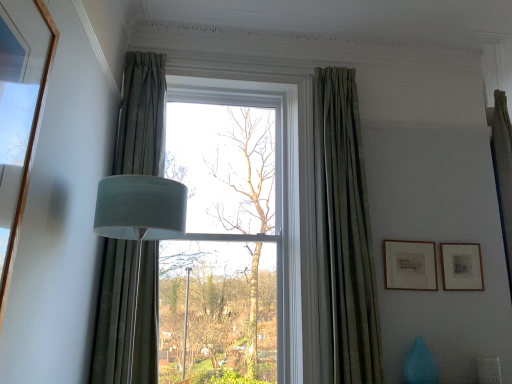
What is the approximate height of green fabric curtain at left, positioned as the 2th curtain in right-to-left order?

2.05 meters.

This screenshot has width=512, height=384. What do you see at coordinates (142, 116) in the screenshot?
I see `green fabric curtain at left, positioned as the 2th curtain in right-to-left order` at bounding box center [142, 116].

What do you see at coordinates (343, 235) in the screenshot? I see `matte glass window at center` at bounding box center [343, 235].

At what (x,y) coordinates should I click in order to perform the action: click on matte gold picture frame at right, the second picture frame in the right-to-left sequence. Please return your answer as a coordinate pair (x, y). The height and width of the screenshot is (384, 512). Looking at the image, I should click on (410, 265).

Does matte blue vase at lower right turn towards matte gold picture frame at right, the second picture frame in the right-to-left sequence?

No.

From the image's perspective, is matte blue vase at lower right located above matte gold picture frame at right, the second picture frame in the right-to-left sequence?

No, from the image's perspective, matte blue vase at lower right is not on top of matte gold picture frame at right, the second picture frame in the right-to-left sequence.

In the scene shown: Is matte blue vase at lower right to the right of matte gold picture frame at right, the second picture frame in the right-to-left sequence, from the viewer's perspective?

In fact, matte blue vase at lower right is to the left of matte gold picture frame at right, the second picture frame in the right-to-left sequence.

Considering the relative sizes of matte blue vase at lower right and matte gold picture frame at right, arranged as the first picture frame when viewed from the left, in the image provided, is matte blue vase at lower right shorter than matte gold picture frame at right, arranged as the first picture frame when viewed from the left,?

Yes, matte blue vase at lower right is shorter than matte gold picture frame at right, arranged as the first picture frame when viewed from the left.

Can you confirm if matte black picture frame at right, which ranks as the second picture frame in left-to-right order, is shorter than matte gold picture frame at right, the second picture frame in the right-to-left sequence?

Yes.

Between matte black picture frame at right, which appears as the first picture frame when viewed from the right, and matte gold picture frame at right, arranged as the first picture frame when viewed from the left, which one appears on the right side from the viewer's perspective?

matte black picture frame at right, which appears as the first picture frame when viewed from the right.

How different are the orientations of matte black picture frame at right, which appears as the first picture frame when viewed from the right, and matte gold picture frame at right, the second picture frame in the right-to-left sequence, in degrees?

There is a 0.00426-degree angle between the facing directions of matte black picture frame at right, which appears as the first picture frame when viewed from the right, and matte gold picture frame at right, the second picture frame in the right-to-left sequence.

How many degrees apart are the facing directions of matte gold picture frame at right, the second picture frame in the right-to-left sequence, and matte glass window at center?

They differ by 1.89 degrees in their facing directions.

From a real-world perspective, is matte gold picture frame at right, the second picture frame in the right-to-left sequence, below matte glass window at center?

Correct, in the physical world, matte gold picture frame at right, the second picture frame in the right-to-left sequence, is lower than matte glass window at center.

The width and height of the screenshot is (512, 384). Identify the location of window in front of the matte gold picture frame at right, arranged as the first picture frame when viewed from the left. point(343,235).

Can you see matte gold picture frame at right, arranged as the first picture frame when viewed from the left, touching matte glass window at center?

No, matte gold picture frame at right, arranged as the first picture frame when viewed from the left, is not making contact with matte glass window at center.

From a real-world perspective, who is located lower, matte black picture frame at right, which ranks as the second picture frame in left-to-right order, or matte glass window at center?

matte black picture frame at right, which ranks as the second picture frame in left-to-right order, from a real-world perspective.

Between matte black picture frame at right, which appears as the first picture frame when viewed from the right, and matte glass window at center, which one has smaller width?

matte black picture frame at right, which appears as the first picture frame when viewed from the right.

Does point (443, 245) appear closer or farther from the camera than point (285, 346)?

Point (443, 245) appears to be farther away from the viewer than point (285, 346).

Is matte black picture frame at right, which appears as the first picture frame when viewed from the right, to the left of matte glass window at center from the viewer's perspective?

Incorrect, matte black picture frame at right, which appears as the first picture frame when viewed from the right, is not on the left side of matte glass window at center.

How much distance is there between green fabric curtain at left, which is the first curtain from left to right, and matte black picture frame at right, which appears as the first picture frame when viewed from the right?

The distance of green fabric curtain at left, which is the first curtain from left to right, from matte black picture frame at right, which appears as the first picture frame when viewed from the right, is 6.38 feet.

Is green fabric curtain at left, positioned as the 2th curtain in right-to-left order, not near matte black picture frame at right, which ranks as the second picture frame in left-to-right order?

Yes, green fabric curtain at left, positioned as the 2th curtain in right-to-left order, is far from matte black picture frame at right, which ranks as the second picture frame in left-to-right order.

Which of these two, green fabric curtain at left, which is the first curtain from left to right, or matte black picture frame at right, which ranks as the second picture frame in left-to-right order, stands taller?

green fabric curtain at left, which is the first curtain from left to right, is taller.

Who is more distant, green fabric curtain at left, positioned as the 2th curtain in right-to-left order, or matte black picture frame at right, which appears as the first picture frame when viewed from the right?

Positioned behind is matte black picture frame at right, which appears as the first picture frame when viewed from the right.

Is green velvet curtain at center, acting as the second curtain starting from the left, not near matte gold picture frame at right, the second picture frame in the right-to-left sequence?

No, green velvet curtain at center, acting as the second curtain starting from the left, is not far away from matte gold picture frame at right, the second picture frame in the right-to-left sequence.

Does point (325, 308) come in front of point (388, 287)?

That is True.

What's the angular difference between green velvet curtain at center, acting as the second curtain starting from the left, and matte gold picture frame at right, the second picture frame in the right-to-left sequence,'s facing directions?

There is a 1.87-degree angle between the facing directions of green velvet curtain at center, acting as the second curtain starting from the left, and matte gold picture frame at right, the second picture frame in the right-to-left sequence.

Considering the sizes of green velvet curtain at center, acting as the second curtain starting from the left, and matte gold picture frame at right, the second picture frame in the right-to-left sequence, in the image, is green velvet curtain at center, acting as the second curtain starting from the left, taller or shorter than matte gold picture frame at right, the second picture frame in the right-to-left sequence,?

Clearly, green velvet curtain at center, acting as the second curtain starting from the left, is taller compared to matte gold picture frame at right, the second picture frame in the right-to-left sequence.

Can you see matte gold picture frame at right, arranged as the first picture frame when viewed from the left, touching matte black picture frame at right, which ranks as the second picture frame in left-to-right order?

No, matte gold picture frame at right, arranged as the first picture frame when viewed from the left, is not beside matte black picture frame at right, which ranks as the second picture frame in left-to-right order.

Between matte gold picture frame at right, the second picture frame in the right-to-left sequence, and matte black picture frame at right, which ranks as the second picture frame in left-to-right order, which one has less height?

Standing shorter between the two is matte black picture frame at right, which ranks as the second picture frame in left-to-right order.

Based on the photo, from the image's perspective, is matte gold picture frame at right, the second picture frame in the right-to-left sequence, under matte black picture frame at right, which ranks as the second picture frame in left-to-right order?

No.

You are a GUI agent. You are given a task and a screenshot of the screen. Output one action in this format:
    pyautogui.click(x=<x>, y=<y>)
    Task: Click on the 1st picture frame to the right of the matte blue vase at lower right, counting from the anchor's position
    
    Given the screenshot: What is the action you would take?
    pyautogui.click(x=410, y=265)

This screenshot has width=512, height=384. I want to click on picture frame below the matte gold picture frame at right, arranged as the first picture frame when viewed from the left (from the image's perspective), so [461, 267].

From the image, which object appears to be farther from green velvet curtain at center, which is the first curtain in right-to-left order, matte gold picture frame at right, arranged as the first picture frame when viewed from the left, or green fabric curtain at left, which is the first curtain from left to right?

The object further to green velvet curtain at center, which is the first curtain in right-to-left order, is green fabric curtain at left, which is the first curtain from left to right.

Looking at the image, which one is located further to matte blue vase at lower right, green velvet curtain at center, acting as the second curtain starting from the left, or matte gold picture frame at right, arranged as the first picture frame when viewed from the left?

Among the two, green velvet curtain at center, acting as the second curtain starting from the left, is located further to matte blue vase at lower right.

Estimate the real-world distances between objects in this image. Which object is further from matte glass window at center, matte gold picture frame at right, the second picture frame in the right-to-left sequence, or matte black picture frame at right, which appears as the first picture frame when viewed from the right?

matte black picture frame at right, which appears as the first picture frame when viewed from the right, lies further to matte glass window at center than the other object.

Which object lies nearer to the anchor point green velvet curtain at center, acting as the second curtain starting from the left, matte blue vase at lower right or matte glass window at center?

matte glass window at center.

From the image, which object appears to be farther from green fabric curtain at left, which is the first curtain from left to right, matte gold picture frame at right, the second picture frame in the right-to-left sequence, or green velvet curtain at center, which is the first curtain in right-to-left order?

matte gold picture frame at right, the second picture frame in the right-to-left sequence, is further to green fabric curtain at left, which is the first curtain from left to right.

From the image, which object appears to be farther from matte glass window at center, matte black picture frame at right, which appears as the first picture frame when viewed from the right, or matte blue vase at lower right?

matte black picture frame at right, which appears as the first picture frame when viewed from the right.

Based on the photo, looking at the image, which one is located further to green velvet curtain at center, which is the first curtain in right-to-left order, matte gold picture frame at right, arranged as the first picture frame when viewed from the left, or matte glass window at center?

Among the two, matte gold picture frame at right, arranged as the first picture frame when viewed from the left, is located further to green velvet curtain at center, which is the first curtain in right-to-left order.

Estimate the real-world distances between objects in this image. Which object is closer to green velvet curtain at center, which is the first curtain in right-to-left order, matte blue vase at lower right or green fabric curtain at left, positioned as the 2th curtain in right-to-left order?

Among the two, matte blue vase at lower right is located nearer to green velvet curtain at center, which is the first curtain in right-to-left order.

Identify the location of curtain between matte glass window at center and matte black picture frame at right, which ranks as the second picture frame in left-to-right order. The image size is (512, 384). (343, 237).

The height and width of the screenshot is (384, 512). In order to click on curtain between matte glass window at center and matte gold picture frame at right, the second picture frame in the right-to-left sequence in this screenshot , I will do `click(343, 237)`.

You are a GUI agent. You are given a task and a screenshot of the screen. Output one action in this format:
    pyautogui.click(x=<x>, y=<y>)
    Task: Click on the vase between matte glass window at center and matte black picture frame at right, which ranks as the second picture frame in left-to-right order
    
    Given the screenshot: What is the action you would take?
    pyautogui.click(x=420, y=364)

Identify the location of picture frame situated between matte glass window at center and matte black picture frame at right, which ranks as the second picture frame in left-to-right order, from left to right. Image resolution: width=512 pixels, height=384 pixels. (410, 265).